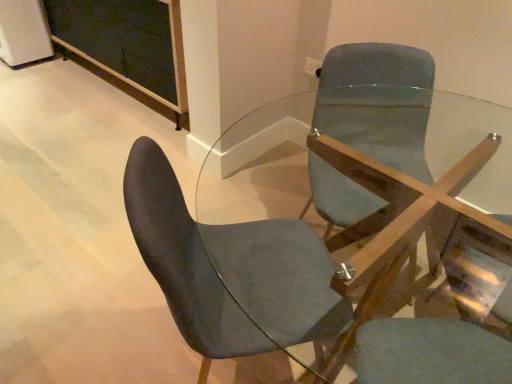
Question: Does matte blue swivel chair at center have a greater width compared to velvet dark blue chair at center?

Choices:
 (A) yes
 (B) no

Answer: (B)

Question: Is there a large distance between matte blue swivel chair at center and velvet dark blue chair at center?

Choices:
 (A) yes
 (B) no

Answer: (B)

Question: Can we say matte blue swivel chair at center lies outside velvet dark blue chair at center?

Choices:
 (A) yes
 (B) no

Answer: (A)

Question: Does matte blue swivel chair at center have a lesser height compared to velvet dark blue chair at center?

Choices:
 (A) no
 (B) yes

Answer: (B)

Question: Is velvet dark blue chair at center completely or partially inside matte blue swivel chair at center?

Choices:
 (A) yes
 (B) no

Answer: (B)

Question: Considering the relative positions of matte blue swivel chair at center and velvet dark blue chair at center in the image provided, is matte blue swivel chair at center to the left of velvet dark blue chair at center from the viewer's perspective?

Choices:
 (A) yes
 (B) no

Answer: (B)

Question: Is velvet dark blue chair at center smaller than matte blue swivel chair at center?

Choices:
 (A) no
 (B) yes

Answer: (A)

Question: From the image's perspective, is velvet dark blue chair at center on top of matte blue swivel chair at center?

Choices:
 (A) yes
 (B) no

Answer: (A)

Question: From a real-world perspective, is velvet dark blue chair at center on matte blue swivel chair at center?

Choices:
 (A) yes
 (B) no

Answer: (B)

Question: Is velvet dark blue chair at center at the left side of matte blue swivel chair at center?

Choices:
 (A) no
 (B) yes

Answer: (B)

Question: Is matte blue swivel chair at center surrounded by velvet dark blue chair at center?

Choices:
 (A) no
 (B) yes

Answer: (A)

Question: From a real-world perspective, does velvet dark blue chair at center sit lower than matte blue swivel chair at center?

Choices:
 (A) no
 (B) yes

Answer: (B)

Question: Is matte blue swivel chair at center looking in the opposite direction of clear glass table at center?

Choices:
 (A) yes
 (B) no

Answer: (A)